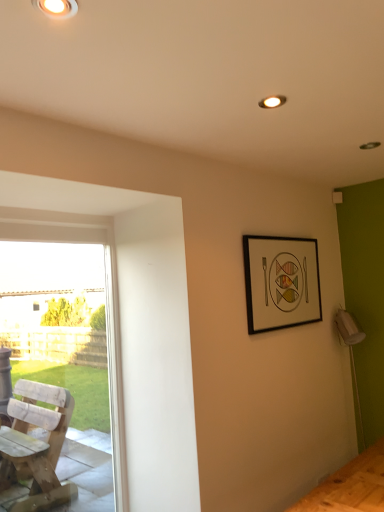
What do you see at coordinates (57, 8) in the screenshot?
I see `matte white ceiling light at upper left` at bounding box center [57, 8].

The height and width of the screenshot is (512, 384). Identify the location of wooden chair at left. [107, 308].

Can you confirm if wooden chair at left is positioned to the left of black matte picture frame at upper right?

Correct, you'll find wooden chair at left to the left of black matte picture frame at upper right.

The height and width of the screenshot is (512, 384). What are the coordinates of `picture frame above the wooden chair at left (from the image's perspective)` in the screenshot? It's located at (281, 282).

Considering their positions, is wooden chair at left located in front of or behind black matte picture frame at upper right?

wooden chair at left is in front of black matte picture frame at upper right.

In the scene shown: From a real-world perspective, is wooden chair at left above or below black matte picture frame at upper right?

Clearly, from a real-world perspective, wooden chair at left is below black matte picture frame at upper right.

Considering the sizes of objects wooden chair at left and matte white ceiling light at upper left in the image provided, who is shorter, wooden chair at left or matte white ceiling light at upper left?

Standing shorter between the two is matte white ceiling light at upper left.

In the scene shown: From the image's perspective, does wooden chair at left appear higher than matte white ceiling light at upper left?

No, from the image's perspective, wooden chair at left is not on top of matte white ceiling light at upper left.

Is wooden chair at left touching matte white ceiling light at upper left?

wooden chair at left and matte white ceiling light at upper left are not in contact.

From a real-world perspective, which is physically below, matte white ceiling light at upper left or black matte picture frame at upper right?

From a 3D spatial view, black matte picture frame at upper right is below.

Between matte white ceiling light at upper left and black matte picture frame at upper right, which one is positioned behind?

black matte picture frame at upper right.

This screenshot has height=512, width=384. Find the location of `picture frame below the matte white ceiling light at upper left (from the image's perspective)`. picture frame below the matte white ceiling light at upper left (from the image's perspective) is located at coordinates (281, 282).

Which point is more distant from viewer, (74,13) or (122,506)?

The point (122,506) is more distant.

Measure the distance from matte white ceiling light at upper left to wooden chair at left.

The distance of matte white ceiling light at upper left from wooden chair at left is 1.51 meters.

From the image's perspective, is matte white ceiling light at upper left located above or below wooden chair at left?

From the image's perspective, matte white ceiling light at upper left appears above wooden chair at left.

Can you confirm if matte white ceiling light at upper left is wider than wooden chair at left?

Correct, the width of matte white ceiling light at upper left exceeds that of wooden chair at left.

Is black matte picture frame at upper right oriented away from wooden chair at left?

No, black matte picture frame at upper right is not facing the opposite direction of wooden chair at left.

Considering the positions of objects black matte picture frame at upper right and wooden chair at left in the image provided, who is behind, black matte picture frame at upper right or wooden chair at left?

black matte picture frame at upper right is further away from the camera.

From a real-world perspective, which is physically below, black matte picture frame at upper right or wooden chair at left?

wooden chair at left is physically lower.

From the image's perspective, is black matte picture frame at upper right on top of matte white ceiling light at upper left?

Actually, black matte picture frame at upper right appears below matte white ceiling light at upper left in the image.

Is black matte picture frame at upper right bigger or smaller than matte white ceiling light at upper left?

Considering their sizes, black matte picture frame at upper right takes up more space than matte white ceiling light at upper left.

Looking at this image, how many degrees apart are the facing directions of black matte picture frame at upper right and matte white ceiling light at upper left?

1.96 degrees separate the facing orientations of black matte picture frame at upper right and matte white ceiling light at upper left.

The image size is (384, 512). Find the location of `window in front of the black matte picture frame at upper right`. window in front of the black matte picture frame at upper right is located at coordinates (107, 308).

Locate an element on the screen. light fixture that is above the wooden chair at left (from the image's perspective) is located at coordinates (57, 8).

From the picture: Looking at the image, which one is located closer to black matte picture frame at upper right, wooden chair at left or matte white ceiling light at upper left?

wooden chair at left lies closer to black matte picture frame at upper right than the other object.

Considering their positions, is matte white ceiling light at upper left positioned closer to black matte picture frame at upper right than wooden chair at left?

The object closer to black matte picture frame at upper right is wooden chair at left.

Estimate the real-world distances between objects in this image. Which object is closer to matte white ceiling light at upper left, wooden chair at left or black matte picture frame at upper right?

wooden chair at left is closer to matte white ceiling light at upper left.

From the image, which object appears to be nearer to wooden chair at left, black matte picture frame at upper right or matte white ceiling light at upper left?

Based on the image, black matte picture frame at upper right appears to be nearer to wooden chair at left.

Considering their positions, is black matte picture frame at upper right positioned closer to matte white ceiling light at upper left than wooden chair at left?

wooden chair at left is positioned closer to the anchor matte white ceiling light at upper left.

Which object lies nearer to the anchor point wooden chair at left, matte white ceiling light at upper left or black matte picture frame at upper right?

black matte picture frame at upper right is closer to wooden chair at left.

The image size is (384, 512). What are the coordinates of `window between matte white ceiling light at upper left and black matte picture frame at upper right from front to back` in the screenshot? It's located at (107, 308).